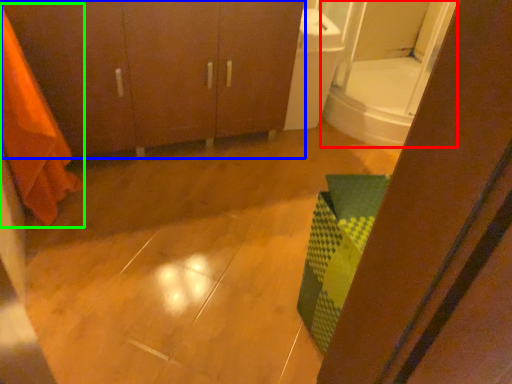
Question: Estimate the real-world distances between objects in this image. Which object is closer to mirror (highlighted by a red box), bathroom cabinet (highlighted by a blue box) or shower curtain (highlighted by a green box)?

Choices:
 (A) bathroom cabinet
 (B) shower curtain

Answer: (A)